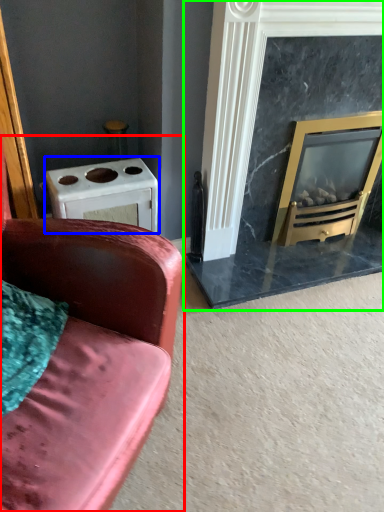
Question: Based on their relative distances, which object is nearer to studio couch (highlighted by a red box)? Choose from appliance (highlighted by a blue box) and fireplace (highlighted by a green box).

Choices:
 (A) appliance
 (B) fireplace

Answer: (A)